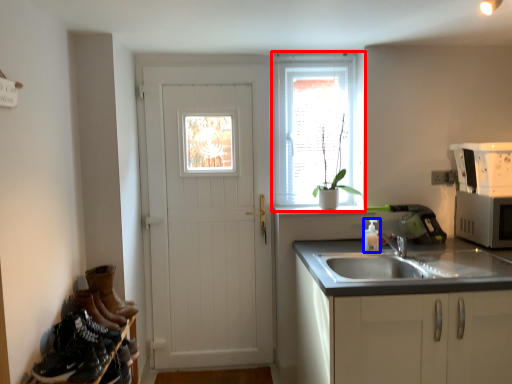
Question: Which point is further to the camera, window (highlighted by a red box) or bottle (highlighted by a blue box)?

Choices:
 (A) window
 (B) bottle

Answer: (A)